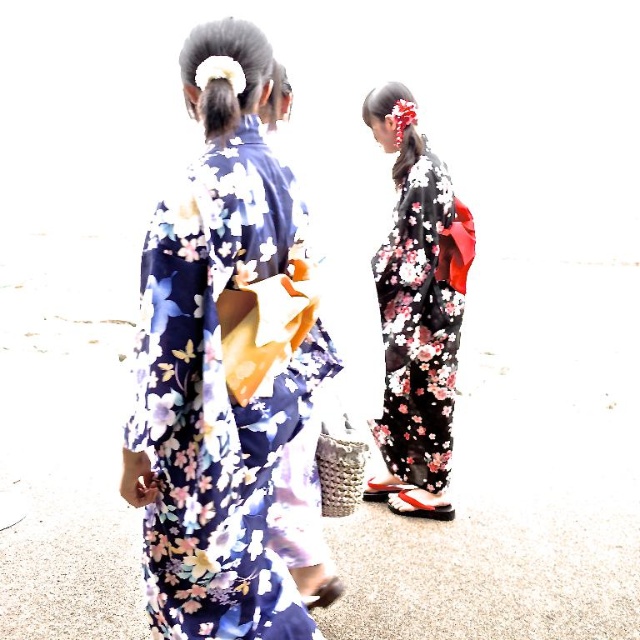
Is floral silk kimono at center shorter than black floral kimono at center?

No, floral silk kimono at center is not shorter than black floral kimono at center.

Between point (259, 317) and point (445, 461), which one is positioned behind?

The point (445, 461) is more distant.

What do you see at coordinates (221, 358) in the screenshot?
I see `floral silk kimono at center` at bounding box center [221, 358].

You are a GUI agent. You are given a task and a screenshot of the screen. Output one action in this format:
    pyautogui.click(x=<x>, y=<y>)
    Task: Click on the floral silk kimono at center
    Image resolution: width=640 pixels, height=640 pixels.
    Given the screenshot: What is the action you would take?
    pyautogui.click(x=221, y=358)